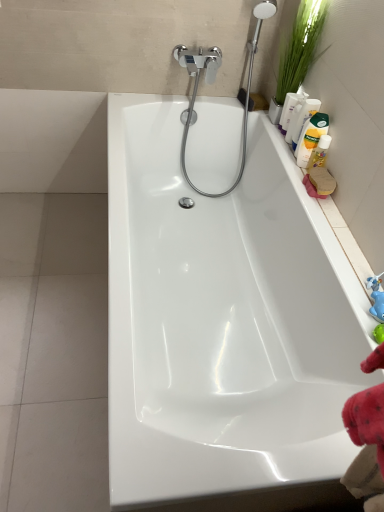
At what (x,y) coordinates should I click in order to perform the action: click on white glossy bathtub at center. Please return your answer as a coordinate pair (x, y). The height and width of the screenshot is (512, 384). Looking at the image, I should click on (222, 311).

This screenshot has height=512, width=384. In order to click on yellow liquid bottle at upper right, arranged as the third cleaning product when viewed from the top in this screenshot , I will do `click(311, 137)`.

This screenshot has width=384, height=512. What do you see at coordinates (319, 153) in the screenshot? I see `translucent plastic bottle at upper right, which ranks as the 4th cleaning product in top-to-bottom order` at bounding box center [319, 153].

Where is `white glossy bathtub at center`? The image size is (384, 512). white glossy bathtub at center is located at coordinates (222, 311).

From the image's perspective, is yellow liquid bottle at upper right, which ranks as the second cleaning product in bottom-to-top order, positioned above or below yellow matte bottle at upper right, the 4th cleaning product when ordered from bottom to top?

From the image's perspective, yellow liquid bottle at upper right, which ranks as the second cleaning product in bottom-to-top order, appears below yellow matte bottle at upper right, the 4th cleaning product when ordered from bottom to top.

Between yellow liquid bottle at upper right, which ranks as the second cleaning product in bottom-to-top order, and yellow matte bottle at upper right, the 4th cleaning product when ordered from bottom to top, which one has larger width?

With larger width is yellow liquid bottle at upper right, which ranks as the second cleaning product in bottom-to-top order.

Is yellow liquid bottle at upper right, arranged as the third cleaning product when viewed from the top, closer to the viewer compared to yellow matte bottle at upper right, the 4th cleaning product when ordered from bottom to top?

Yes, the depth of yellow liquid bottle at upper right, arranged as the third cleaning product when viewed from the top, is less than that of yellow matte bottle at upper right, the 4th cleaning product when ordered from bottom to top.

Find the location of `cleaning product that is the 2nd one when counting leftward from the yellow liquid bottle at upper right, arranged as the third cleaning product when viewed from the top`. cleaning product that is the 2nd one when counting leftward from the yellow liquid bottle at upper right, arranged as the third cleaning product when viewed from the top is located at coordinates (290, 108).

Measure the distance from blue rubber toy at right to yellow liquid bottle at upper right, which ranks as the second cleaning product in bottom-to-top order.

61.54 centimeters.

From the image's perspective, is blue rubber toy at right above yellow liquid bottle at upper right, which ranks as the second cleaning product in bottom-to-top order?

No, from the image's perspective, blue rubber toy at right is not over yellow liquid bottle at upper right, which ranks as the second cleaning product in bottom-to-top order.

Is blue rubber toy at right further to camera compared to yellow liquid bottle at upper right, which ranks as the second cleaning product in bottom-to-top order?

No, the depth of blue rubber toy at right is less than that of yellow liquid bottle at upper right, which ranks as the second cleaning product in bottom-to-top order.

Looking at this image, does blue rubber toy at right have a larger size compared to yellow liquid bottle at upper right, which ranks as the second cleaning product in bottom-to-top order?

No.

Looking at this image, can we say white glossy bathtub at center lies outside green leafy plant at upper right?

Yes, white glossy bathtub at center is not within green leafy plant at upper right.

Is white glossy bathtub at center positioned far away from green leafy plant at upper right?

Actually, white glossy bathtub at center and green leafy plant at upper right are a little close together.

Looking at this image, from a real-world perspective, is white glossy bathtub at center on top of green leafy plant at upper right?

No, from a real-world perspective, white glossy bathtub at center is not on top of green leafy plant at upper right.

From the image's perspective, does yellow liquid bottle at upper right, arranged as the third cleaning product when viewed from the top, appear lower than green leafy plant at upper right?

Yes, from the image's perspective, yellow liquid bottle at upper right, arranged as the third cleaning product when viewed from the top, is beneath green leafy plant at upper right.

Is yellow liquid bottle at upper right, which ranks as the second cleaning product in bottom-to-top order, positioned with its back to green leafy plant at upper right?

yellow liquid bottle at upper right, which ranks as the second cleaning product in bottom-to-top order, does not have its back to green leafy plant at upper right.

Relative to green leafy plant at upper right, is yellow liquid bottle at upper right, arranged as the third cleaning product when viewed from the top, in front or behind?

Visually, yellow liquid bottle at upper right, arranged as the third cleaning product when viewed from the top, is located behind green leafy plant at upper right.

What's the angular difference between yellow liquid bottle at upper right, arranged as the third cleaning product when viewed from the top, and green leafy plant at upper right's facing directions?

2.51 degrees.

Is translucent plastic bottle at upper right, which ranks as the 4th cleaning product in top-to-bottom order, not inside yellow liquid bottle at upper right, arranged as the third cleaning product when viewed from the top?

Yes, translucent plastic bottle at upper right, which ranks as the 4th cleaning product in top-to-bottom order, is located beyond the bounds of yellow liquid bottle at upper right, arranged as the third cleaning product when viewed from the top.

Considering the sizes of objects translucent plastic bottle at upper right, which ranks as the 4th cleaning product in top-to-bottom order, and yellow liquid bottle at upper right, which ranks as the second cleaning product in bottom-to-top order, in the image provided, who is thinner, translucent plastic bottle at upper right, which ranks as the 4th cleaning product in top-to-bottom order, or yellow liquid bottle at upper right, which ranks as the second cleaning product in bottom-to-top order,?

With smaller width is translucent plastic bottle at upper right, which ranks as the 4th cleaning product in top-to-bottom order.

In the image, is translucent plastic bottle at upper right, which ranks as the 4th cleaning product in top-to-bottom order, on the left side or the right side of yellow liquid bottle at upper right, which ranks as the second cleaning product in bottom-to-top order?

translucent plastic bottle at upper right, which ranks as the 4th cleaning product in top-to-bottom order, is to the right of yellow liquid bottle at upper right, which ranks as the second cleaning product in bottom-to-top order.

Between yellow liquid bottle at upper right, which ranks as the second cleaning product in bottom-to-top order, and matte white bottle at upper right, which is the 2th cleaning product from top to bottom, which one has smaller size?

Smaller between the two is matte white bottle at upper right, which is the 2th cleaning product from top to bottom.

Is the position of yellow liquid bottle at upper right, which ranks as the second cleaning product in bottom-to-top order, more distant than that of matte white bottle at upper right, which is the 2th cleaning product from top to bottom?

No, yellow liquid bottle at upper right, which ranks as the second cleaning product in bottom-to-top order, is closer to the camera.

Considering the relative positions of yellow liquid bottle at upper right, arranged as the third cleaning product when viewed from the top, and matte white bottle at upper right, which is the 2th cleaning product from top to bottom, in the image provided, is yellow liquid bottle at upper right, arranged as the third cleaning product when viewed from the top, to the right of matte white bottle at upper right, which is the 2th cleaning product from top to bottom, from the viewer's perspective?

Correct, you'll find yellow liquid bottle at upper right, arranged as the third cleaning product when viewed from the top, to the right of matte white bottle at upper right, which is the 2th cleaning product from top to bottom.

Can you confirm if white glossy bathtub at center is wider than yellow matte bottle at upper right, the 4th cleaning product when ordered from bottom to top?

Correct, the width of white glossy bathtub at center exceeds that of yellow matte bottle at upper right, the 4th cleaning product when ordered from bottom to top.

From the image's perspective, is white glossy bathtub at center under yellow matte bottle at upper right, the 4th cleaning product when ordered from bottom to top?

Yes, from the image's perspective, white glossy bathtub at center is beneath yellow matte bottle at upper right, the 4th cleaning product when ordered from bottom to top.

Can you tell me how much white glossy bathtub at center and yellow matte bottle at upper right, the first cleaning product from the top, differ in facing direction?

The facing directions of white glossy bathtub at center and yellow matte bottle at upper right, the first cleaning product from the top, are 12.5 degrees apart.

Which object is further away from the camera taking this photo, white glossy bathtub at center or yellow matte bottle at upper right, the 4th cleaning product when ordered from bottom to top?

yellow matte bottle at upper right, the 4th cleaning product when ordered from bottom to top, is more distant.

I want to click on the 2nd cleaning product to the right of the yellow matte bottle at upper right, the first cleaning product from the top, counting from the anchor's position, so click(x=311, y=137).

You are a GUI agent. You are given a task and a screenshot of the screen. Output one action in this format:
    pyautogui.click(x=<x>, y=<y>)
    Task: Click on the 2nd cleaning product counting from the left side of the blue rubber toy at right
    
    Given the screenshot: What is the action you would take?
    pyautogui.click(x=311, y=137)

Which object lies nearer to the anchor point yellow matte bottle at upper right, the 4th cleaning product when ordered from bottom to top, yellow liquid bottle at upper right, which ranks as the second cleaning product in bottom-to-top order, or green leafy plant at upper right?

The object closer to yellow matte bottle at upper right, the 4th cleaning product when ordered from bottom to top, is green leafy plant at upper right.

Based on their spatial positions, is blue rubber toy at right or yellow liquid bottle at upper right, which ranks as the second cleaning product in bottom-to-top order, closer to white glossy bathtub at center?

yellow liquid bottle at upper right, which ranks as the second cleaning product in bottom-to-top order, is positioned closer to the anchor white glossy bathtub at center.

Estimate the real-world distances between objects in this image. Which object is closer to yellow matte bottle at upper right, the 4th cleaning product when ordered from bottom to top, matte white bottle at upper right, which is the 2th cleaning product from top to bottom, or translucent plastic bottle at upper right, the 1th cleaning product when ordered from bottom to top?

The object closer to yellow matte bottle at upper right, the 4th cleaning product when ordered from bottom to top, is matte white bottle at upper right, which is the 2th cleaning product from top to bottom.

Estimate the real-world distances between objects in this image. Which object is closer to matte white bottle at upper right, which is the third cleaning product from bottom to top, yellow matte bottle at upper right, the first cleaning product from the top, or yellow liquid bottle at upper right, which ranks as the second cleaning product in bottom-to-top order?

yellow matte bottle at upper right, the first cleaning product from the top, is positioned closer to the anchor matte white bottle at upper right, which is the third cleaning product from bottom to top.

Based on their spatial positions, is green leafy plant at upper right or translucent plastic bottle at upper right, the 1th cleaning product when ordered from bottom to top, closer to yellow liquid bottle at upper right, arranged as the third cleaning product when viewed from the top?

Based on the image, translucent plastic bottle at upper right, the 1th cleaning product when ordered from bottom to top, appears to be nearer to yellow liquid bottle at upper right, arranged as the third cleaning product when viewed from the top.

Looking at the image, which one is located further to blue rubber toy at right, white glossy bathtub at center or green leafy plant at upper right?

green leafy plant at upper right is positioned further to the anchor blue rubber toy at right.

Which object lies further to the anchor point yellow matte bottle at upper right, the first cleaning product from the top, blue rubber toy at right or yellow liquid bottle at upper right, arranged as the third cleaning product when viewed from the top?

blue rubber toy at right is further to yellow matte bottle at upper right, the first cleaning product from the top.

Estimate the real-world distances between objects in this image. Which object is closer to matte white bottle at upper right, which is the third cleaning product from bottom to top, blue rubber toy at right or yellow matte bottle at upper right, the 4th cleaning product when ordered from bottom to top?

yellow matte bottle at upper right, the 4th cleaning product when ordered from bottom to top.

Find the location of `toy between white glossy bathtub at center and translucent plastic bottle at upper right, the 1th cleaning product when ordered from bottom to top, along the z-axis`. toy between white glossy bathtub at center and translucent plastic bottle at upper right, the 1th cleaning product when ordered from bottom to top, along the z-axis is located at coordinates (376, 297).

Image resolution: width=384 pixels, height=512 pixels. I want to click on cleaning product between matte white bottle at upper right, which is the 2th cleaning product from top to bottom, and translucent plastic bottle at upper right, the 1th cleaning product when ordered from bottom to top, from top to bottom, so click(311, 137).

The height and width of the screenshot is (512, 384). What are the coordinates of `toy positioned between white glossy bathtub at center and yellow liquid bottle at upper right, arranged as the third cleaning product when viewed from the top, from near to far` in the screenshot? It's located at (376, 297).

The image size is (384, 512). Identify the location of toy between white glossy bathtub at center and yellow matte bottle at upper right, the 4th cleaning product when ordered from bottom to top, in the front-back direction. (376, 297).